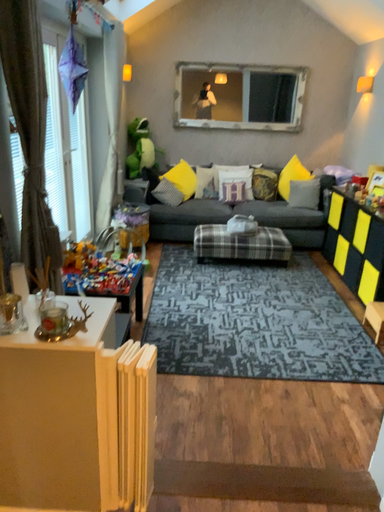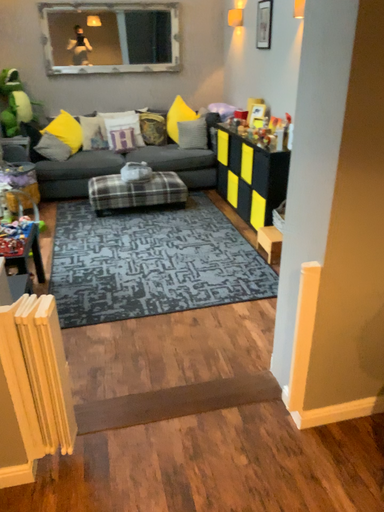
Question: Which way did the camera rotate in the video?

Choices:
 (A) rotated left
 (B) rotated right

Answer: (B)